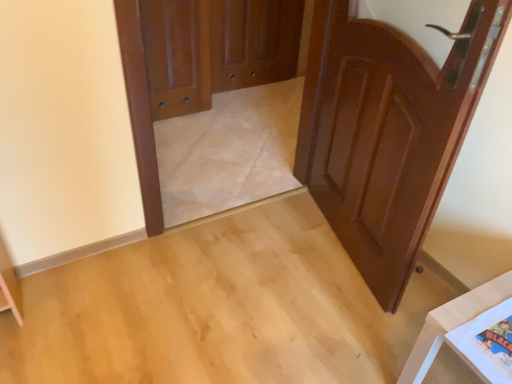
In order to face white glossy table at lower right, should I rotate leftwards or rightwards?

A 29.858 degree turn to the right will do.

Describe the element at coordinates (176, 56) in the screenshot. I see `polished wood door at upper left, which is the first door from left to right` at that location.

Identify the location of shiny brown door at right, the first door positioned from the front. This screenshot has width=512, height=384. point(388,130).

Is white glossy table at lower right taller or shorter than polished wood door at upper left, which is the first door from left to right?

white glossy table at lower right is shorter than polished wood door at upper left, which is the first door from left to right.

Is white glossy table at lower right facing away from polished wood door at upper left, placed as the second door when sorted from front to back?

white glossy table at lower right does not have its back to polished wood door at upper left, placed as the second door when sorted from front to back.

Is point (424, 346) positioned before point (203, 77)?

That is True.

Is white glossy table at lower right surrounding polished wood door at upper left, the 2th door from the right?

No, polished wood door at upper left, the 2th door from the right, is not a part of white glossy table at lower right.

From a real-world perspective, does white glossy table at lower right sit lower than brown wooden screen door at center?

Yes, from a real-world perspective, white glossy table at lower right is under brown wooden screen door at center.

Is white glossy table at lower right with brown wooden screen door at center?

No.

Looking at this image, which is correct: white glossy table at lower right is inside brown wooden screen door at center, or outside of it?

white glossy table at lower right is located beyond the bounds of brown wooden screen door at center.

Identify the location of furniture on the right of brown wooden screen door at center. Image resolution: width=512 pixels, height=384 pixels. (451, 324).

Is polished wood door at upper left, the 2th door from the right, oriented towards brown wooden screen door at center?

No, polished wood door at upper left, the 2th door from the right, is not oriented towards brown wooden screen door at center.

From a real-world perspective, is polished wood door at upper left, which is counted as the first door, starting from the back, positioned above or below brown wooden screen door at center?

From a real-world perspective, polished wood door at upper left, which is counted as the first door, starting from the back, is physically above brown wooden screen door at center.

Which of these two, polished wood door at upper left, placed as the second door when sorted from front to back, or brown wooden screen door at center, stands taller?

polished wood door at upper left, placed as the second door when sorted from front to back, is taller.

Would you say polished wood door at upper left, the 2th door from the right, contains brown wooden screen door at center?

That's incorrect, brown wooden screen door at center is not inside polished wood door at upper left, the 2th door from the right.

Is brown wooden screen door at center not within polished wood door at upper left, placed as the second door when sorted from front to back?

That's correct, brown wooden screen door at center is outside of polished wood door at upper left, placed as the second door when sorted from front to back.

The height and width of the screenshot is (384, 512). What are the coordinates of `screen door on the right of polished wood door at upper left, the 2th door from the right` in the screenshot? It's located at (254, 42).

From a real-world perspective, is brown wooden screen door at center over polished wood door at upper left, the 2th door from the right?

Incorrect, from a real-world perspective, brown wooden screen door at center is lower than polished wood door at upper left, the 2th door from the right.

Can you confirm if brown wooden screen door at center is positioned to the left of polished wood door at upper left, which is counted as the first door, starting from the back?

No, brown wooden screen door at center is not to the left of polished wood door at upper left, which is counted as the first door, starting from the back.

Can you confirm if brown wooden screen door at center is taller than white glossy table at lower right?

Indeed, brown wooden screen door at center has a greater height compared to white glossy table at lower right.

From the picture: Does brown wooden screen door at center come behind white glossy table at lower right?

Yes.

Where is `screen door above the white glossy table at lower right (from the image's perspective)`? The width and height of the screenshot is (512, 384). screen door above the white glossy table at lower right (from the image's perspective) is located at coordinates (254, 42).

From a real-world perspective, is brown wooden screen door at center physically located above or below white glossy table at lower right?

brown wooden screen door at center is above white glossy table at lower right.

Between shiny brown door at right, which appears as the 1th door when viewed from the right, and brown wooden screen door at center, which one appears on the left side from the viewer's perspective?

From the viewer's perspective, brown wooden screen door at center appears more on the left side.

There is a brown wooden screen door at center. At what (x,y) coordinates should I click in order to perform the action: click on the 2nd door below it (from the image's perspective). Please return your answer as a coordinate pair (x, y). This screenshot has width=512, height=384. Looking at the image, I should click on coord(388,130).

From the image's perspective, which one is positioned lower, shiny brown door at right, which appears as the 1th door when viewed from the right, or brown wooden screen door at center?

shiny brown door at right, which appears as the 1th door when viewed from the right.

Is shiny brown door at right, the first door positioned from the front, facing away from white glossy table at lower right?

That's not correct — shiny brown door at right, the first door positioned from the front, is not looking away from white glossy table at lower right.

Is shiny brown door at right, the 2th door in the back-to-front sequence, further to camera compared to white glossy table at lower right?

No, shiny brown door at right, the 2th door in the back-to-front sequence, is closer to the viewer.

Is shiny brown door at right, the 2th door in the back-to-front sequence, to the right of white glossy table at lower right from the viewer's perspective?

No.

Who is taller, shiny brown door at right, the 2th door in the back-to-front sequence, or white glossy table at lower right?

Standing taller between the two is shiny brown door at right, the 2th door in the back-to-front sequence.

You are a GUI agent. You are given a task and a screenshot of the screen. Output one action in this format:
    pyautogui.click(x=<x>, y=<y>)
    Task: Click on the furniture below the polished wood door at upper left, which is the first door from left to right (from a real-world perspective)
    
    Given the screenshot: What is the action you would take?
    pyautogui.click(x=451, y=324)

Where is `screen door positioned vertically above the white glossy table at lower right (from a real-world perspective)`? The image size is (512, 384). screen door positioned vertically above the white glossy table at lower right (from a real-world perspective) is located at coordinates (254, 42).

From the image, which object appears to be nearer to shiny brown door at right, the first door positioned from the front, white glossy table at lower right or brown wooden screen door at center?

white glossy table at lower right is closer to shiny brown door at right, the first door positioned from the front.

Based on their spatial positions, is white glossy table at lower right or polished wood door at upper left, which is the first door from left to right, closer to shiny brown door at right, the 2th door in the back-to-front sequence?

Based on the image, white glossy table at lower right appears to be nearer to shiny brown door at right, the 2th door in the back-to-front sequence.

From the image, which object appears to be nearer to white glossy table at lower right, polished wood door at upper left, placed as the second door when sorted from front to back, or brown wooden screen door at center?

polished wood door at upper left, placed as the second door when sorted from front to back, lies closer to white glossy table at lower right than the other object.

When comparing their distances from polished wood door at upper left, placed as the second door when sorted from front to back, does white glossy table at lower right or brown wooden screen door at center seem further?

white glossy table at lower right lies further to polished wood door at upper left, placed as the second door when sorted from front to back, than the other object.

Consider the image. From the image, which object appears to be nearer to white glossy table at lower right, polished wood door at upper left, placed as the second door when sorted from front to back, or shiny brown door at right, the second door viewed from the left?

Based on the image, shiny brown door at right, the second door viewed from the left, appears to be nearer to white glossy table at lower right.

Which object lies nearer to the anchor point shiny brown door at right, the first door positioned from the front, polished wood door at upper left, which is counted as the first door, starting from the back, or brown wooden screen door at center?

polished wood door at upper left, which is counted as the first door, starting from the back.

Looking at the image, which one is located further to brown wooden screen door at center, white glossy table at lower right or shiny brown door at right, which appears as the 1th door when viewed from the right?

Based on the image, white glossy table at lower right appears to be further to brown wooden screen door at center.

Considering their positions, is white glossy table at lower right positioned further to polished wood door at upper left, placed as the second door when sorted from front to back, than shiny brown door at right, the 2th door in the back-to-front sequence?

Based on the image, white glossy table at lower right appears to be further to polished wood door at upper left, placed as the second door when sorted from front to back.

You are a GUI agent. You are given a task and a screenshot of the screen. Output one action in this format:
    pyautogui.click(x=<x>, y=<y>)
    Task: Click on the door positioned between shiny brown door at right, the second door viewed from the left, and brown wooden screen door at center from near to far
    The image size is (512, 384).
    Given the screenshot: What is the action you would take?
    pyautogui.click(x=176, y=56)

Where is `furniture between shiny brown door at right, which appears as the 1th door when viewed from the right, and polished wood door at upper left, the 2th door from the right, in the front-back direction`? furniture between shiny brown door at right, which appears as the 1th door when viewed from the right, and polished wood door at upper left, the 2th door from the right, in the front-back direction is located at coordinates (451, 324).

Identify the location of furniture between shiny brown door at right, the first door positioned from the front, and brown wooden screen door at center in the front-back direction. (451, 324).

Where is `door between white glossy table at lower right and brown wooden screen door at center from front to back`? Image resolution: width=512 pixels, height=384 pixels. door between white glossy table at lower right and brown wooden screen door at center from front to back is located at coordinates (176, 56).